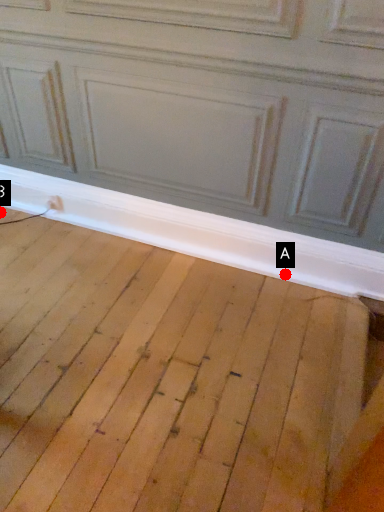
Question: Two points are circled on the image, labeled by A and B beside each circle. Which point is closer to the camera taking this photo?

Choices:
 (A) A is closer
 (B) B is closer

Answer: (A)